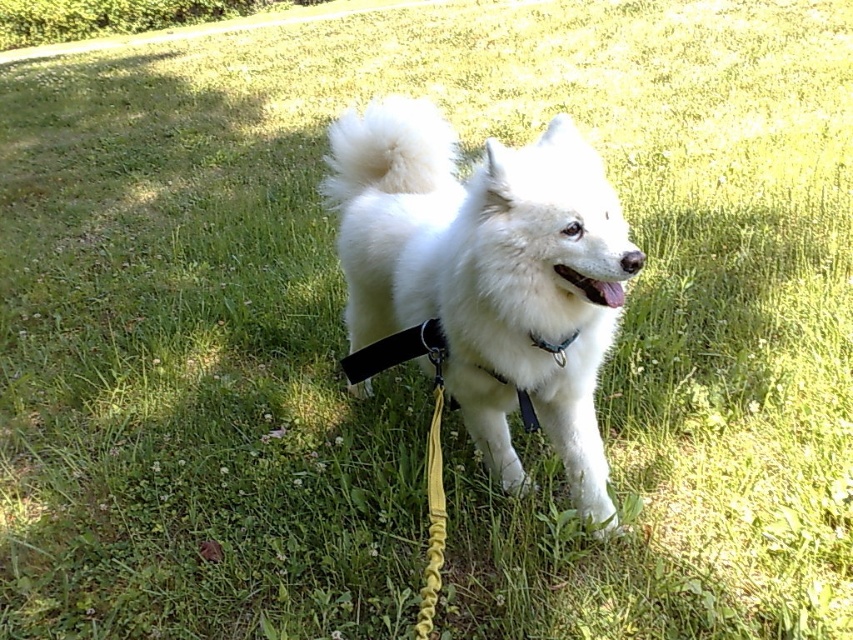
Consider the image. You are a dog owner who wants to ensure the safety of your pet. Based on the image, can you determine if the black plastic neckband at center is appropriate for the white fluffy dog at center in terms of size?

The white fluffy dog at center has a larger size compared to black plastic neckband at center, so the neckband is too small for the dog and may not provide proper safety or comfort.

You are a dog owner who wants to ensure your dog stays visible while walking. You have a white fluffy dog at center wearing a black nylon strap at center. Which object is taller and therefore more visible from a distance?

The white fluffy dog at center is taller than the black nylon strap at center, so the dog will be more visible from a distance.